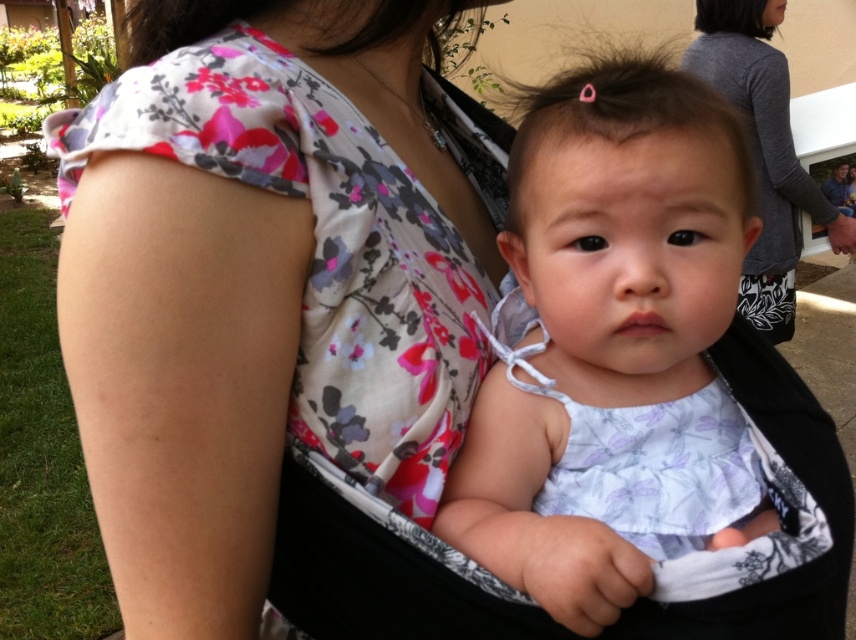
You are a photographer trying to capture a photo of the white floral dress at center and the gray matte shirt at upper right in the image. The camera you are using has a maximum focus range of 6 feet. Can you capture both subjects in focus without moving the camera?

The white floral dress at center and gray matte shirt at upper right are 6.30 feet apart. Since the distance between them exceeds the camera maximum focus range of 6 feet, you cannot capture both subjects in focus without moving the camera.

You are a photographer setting up a shoot and notice the white floral dress at center and the gray matte shirt at upper right in the scene. Which clothing item is located to the left of the other?

The white floral dress at center is positioned on the left side of gray matte shirt at upper right.

You are a photographer setting up a shoot. You notice the white floral dress at center and the gray matte shirt at upper right in the scene. Which clothing item is positioned lower in the image?

The white floral dress at center is located below the gray matte shirt at upper right, so the white floral dress at center is positioned lower in the image.